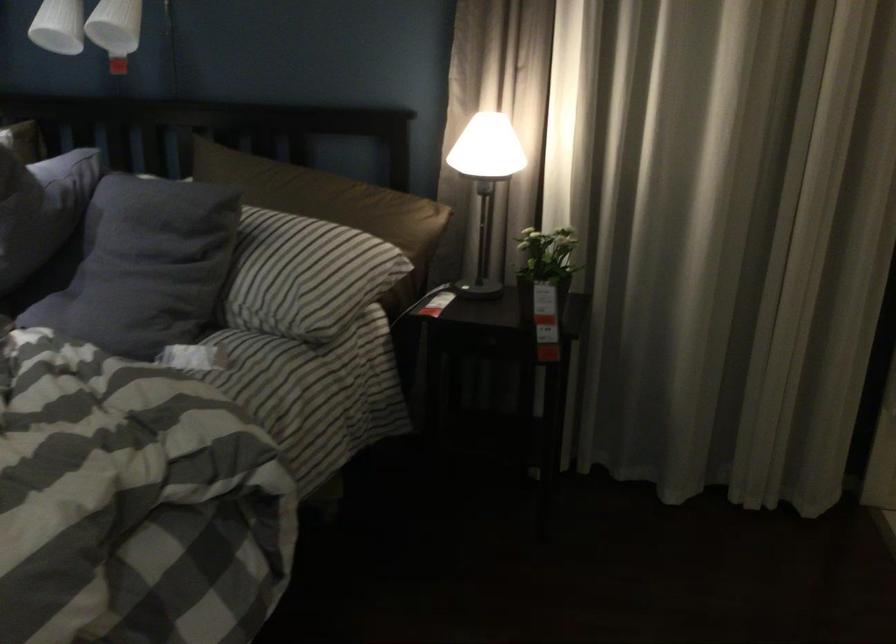
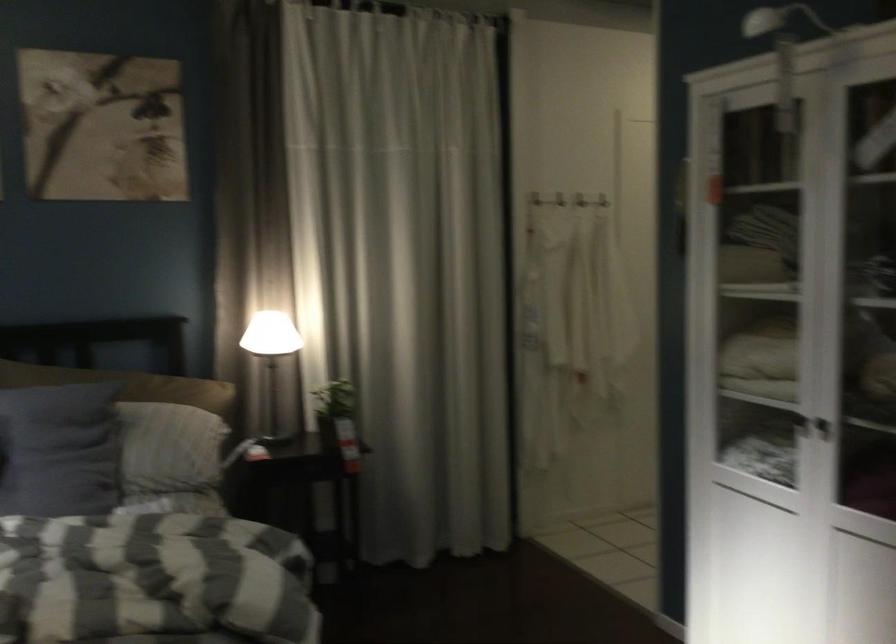
Where in the second image is the point corresponding to [150,257] from the first image?

(58, 450)